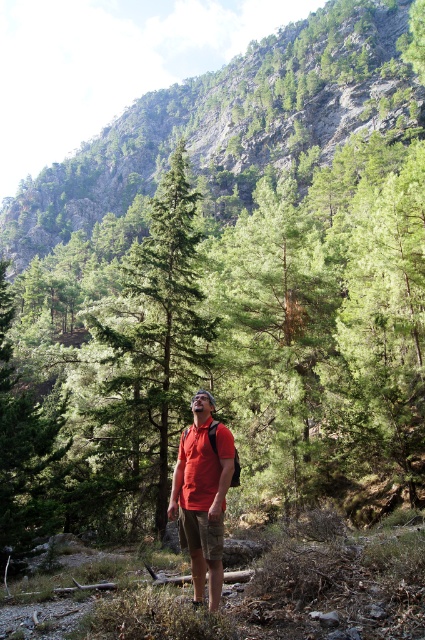
Is green matte tree at center bigger than matte red shirt at center?

Correct, green matte tree at center is larger in size than matte red shirt at center.

This screenshot has width=425, height=640. What do you see at coordinates (156, 326) in the screenshot? I see `green matte tree at center` at bounding box center [156, 326].

Looking at this image, who is more forward, (127, 412) or (224, 477)?

Point (224, 477)

I want to click on green matte tree at center, so click(x=156, y=326).